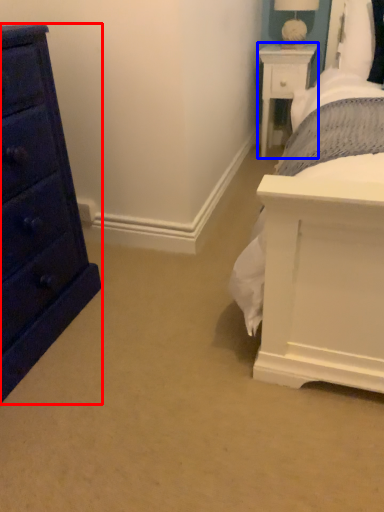
Question: Which of the following is the farthest to the observer, chest of drawers (highlighted by a red box) or nightstand (highlighted by a blue box)?

Choices:
 (A) chest of drawers
 (B) nightstand

Answer: (B)